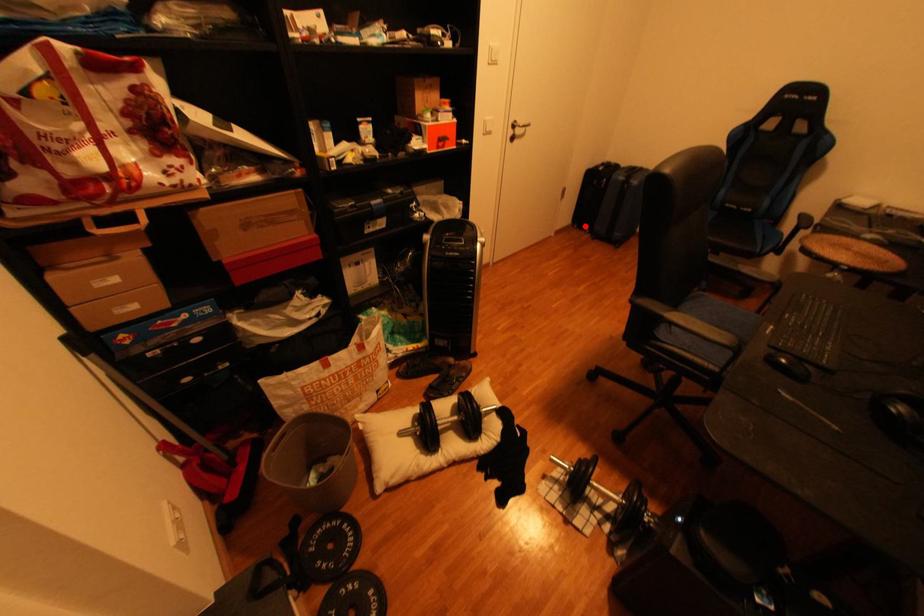
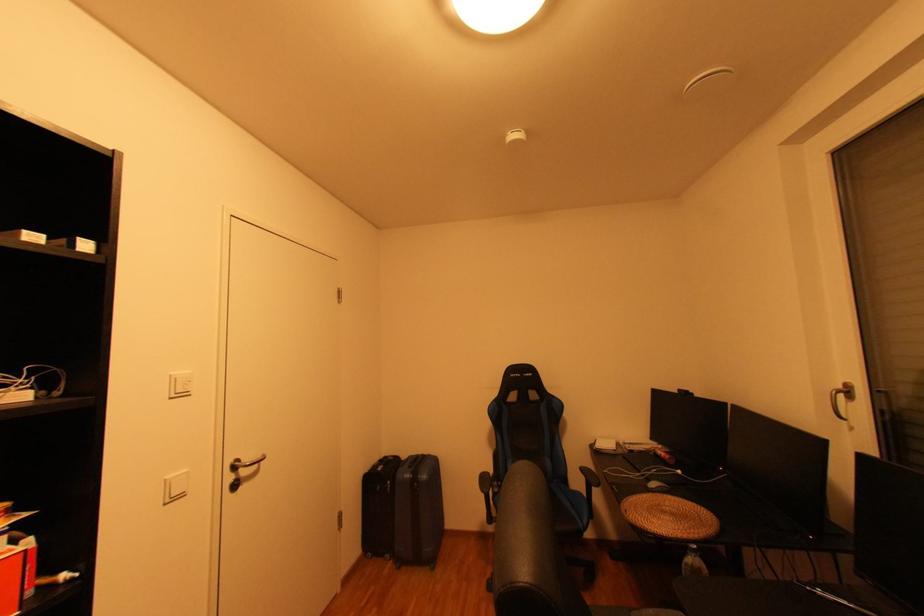
Where in the second image is the point corresponding to the highlighted location from the first image?

(380, 554)